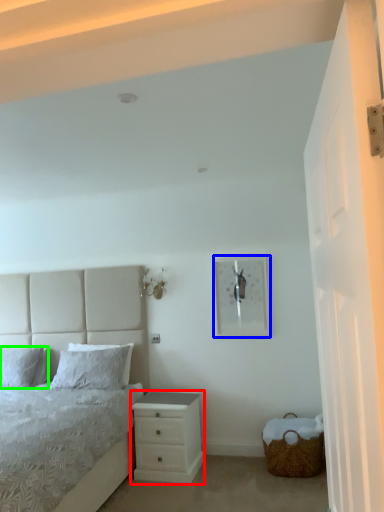
Question: Estimate the real-world distances between objects in this image. Which object is farther from chest of drawers (highlighted by a red box), picture frame (highlighted by a blue box) or pillow (highlighted by a green box)?

Choices:
 (A) picture frame
 (B) pillow

Answer: (B)